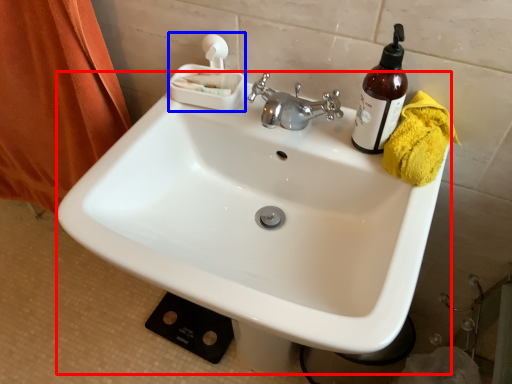
Question: Which point is closer to the camera, sink (highlighted by a red box) or tissue (highlighted by a blue box)?

Choices:
 (A) sink
 (B) tissue

Answer: (A)